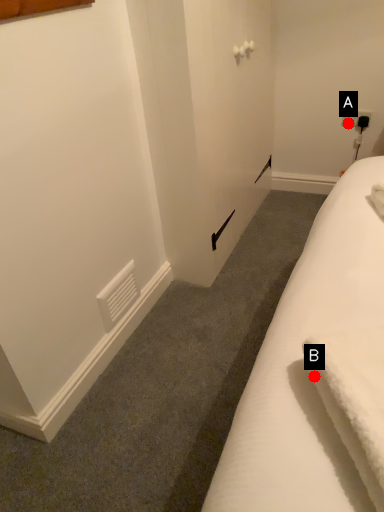
Question: Two points are circled on the image, labeled by A and B beside each circle. Which point is closer to the camera?

Choices:
 (A) A is closer
 (B) B is closer

Answer: (B)